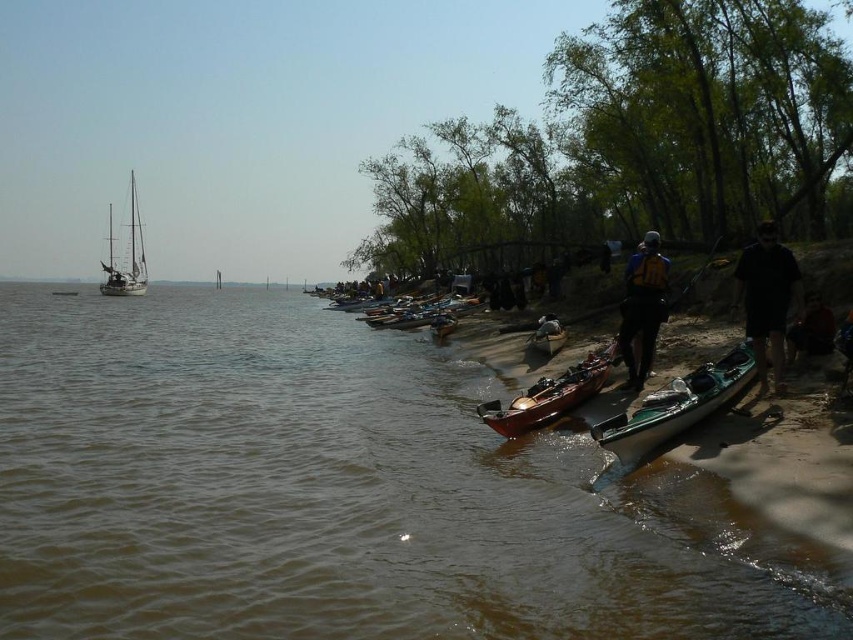
Does green plastic kayak at lower right appear on the right side of matte brown canoe at center?

Yes, green plastic kayak at lower right is to the right of matte brown canoe at center.

What do you see at coordinates (676, 404) in the screenshot?
I see `green plastic kayak at lower right` at bounding box center [676, 404].

You are a GUI agent. You are given a task and a screenshot of the screen. Output one action in this format:
    pyautogui.click(x=<x>, y=<y>)
    Task: Click on the green plastic kayak at lower right
    
    Given the screenshot: What is the action you would take?
    pyautogui.click(x=676, y=404)

Is brown matte water at lower left further to the viewer compared to black fabric person at right?

No.

Between brown matte water at lower left and black fabric person at right, which one is positioned lower?

brown matte water at lower left is lower down.

Where is `brown matte water at lower left`? Image resolution: width=853 pixels, height=640 pixels. brown matte water at lower left is located at coordinates (340, 493).

Can you confirm if wooden canoe at center is thinner than matte black kayak at center?

No, wooden canoe at center is not thinner than matte black kayak at center.

Between point (572, 403) and point (544, 317), which one is positioned in front?

Point (572, 403)

You are a GUI agent. You are given a task and a screenshot of the screen. Output one action in this format:
    pyautogui.click(x=<x>, y=<y>)
    Task: Click on the wooden canoe at center
    The width and height of the screenshot is (853, 640).
    Given the screenshot: What is the action you would take?
    pyautogui.click(x=550, y=396)

This screenshot has width=853, height=640. Find the location of `wooden canoe at center`. wooden canoe at center is located at coordinates (550, 396).